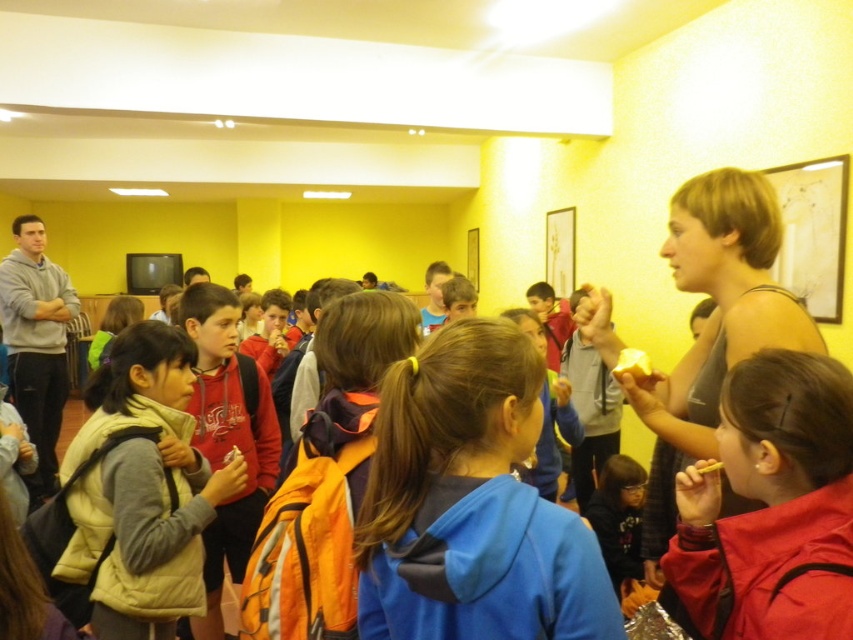
Does blue fleece jacket at center appear over light yellow puffer vest at center?

Yes.

Can you confirm if blue fleece jacket at center is smaller than light yellow puffer vest at center?

Correct, blue fleece jacket at center occupies less space than light yellow puffer vest at center.

Which is in front, point (524, 570) or point (216, 476)?

Point (524, 570) is more forward.

Locate an element on the screen. blue fleece jacket at center is located at coordinates (471, 504).

Is point (486, 336) less distant than point (840, 436)?

No, it is not.

Can you confirm if blue fleece jacket at center is taller than matte red jacket at lower right?

Incorrect, blue fleece jacket at center's height is not larger of matte red jacket at lower right's.

Where is `blue fleece jacket at center`? Image resolution: width=853 pixels, height=640 pixels. blue fleece jacket at center is located at coordinates (471, 504).

Does matte red jacket at lower right appear under light yellow puffer vest at center?

No, matte red jacket at lower right is not below light yellow puffer vest at center.

Between point (762, 580) and point (99, 548), which one is positioned in front?

Positioned in front is point (762, 580).

Where is `matte red jacket at lower right`? This screenshot has width=853, height=640. matte red jacket at lower right is located at coordinates (770, 508).